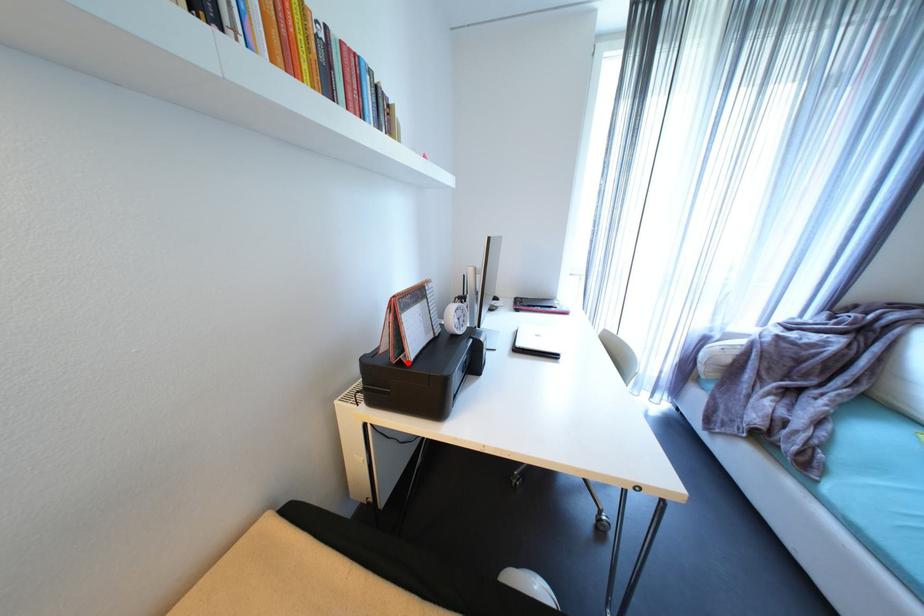
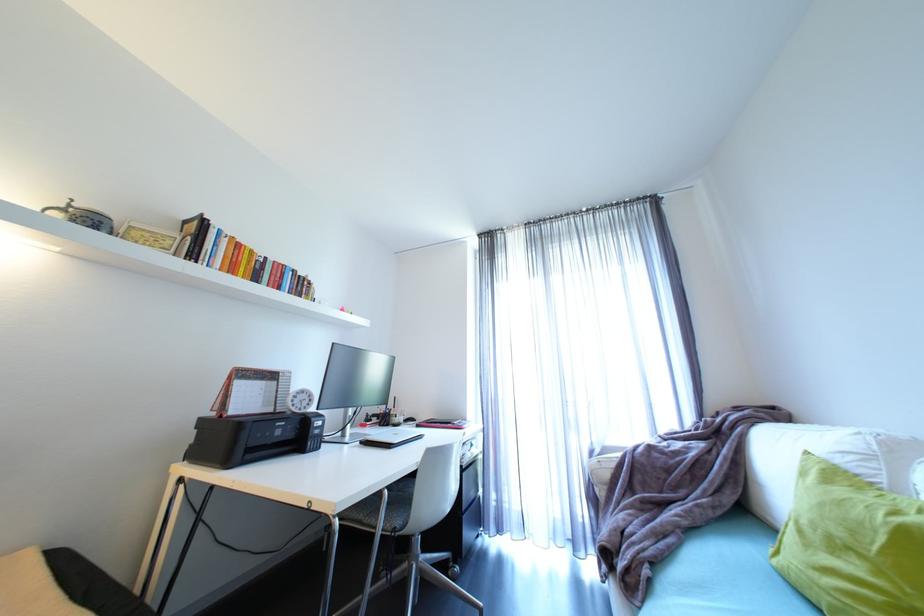
Locate, in the second image, the point that corresponds to the highlighted location in the first image.

(228, 416)